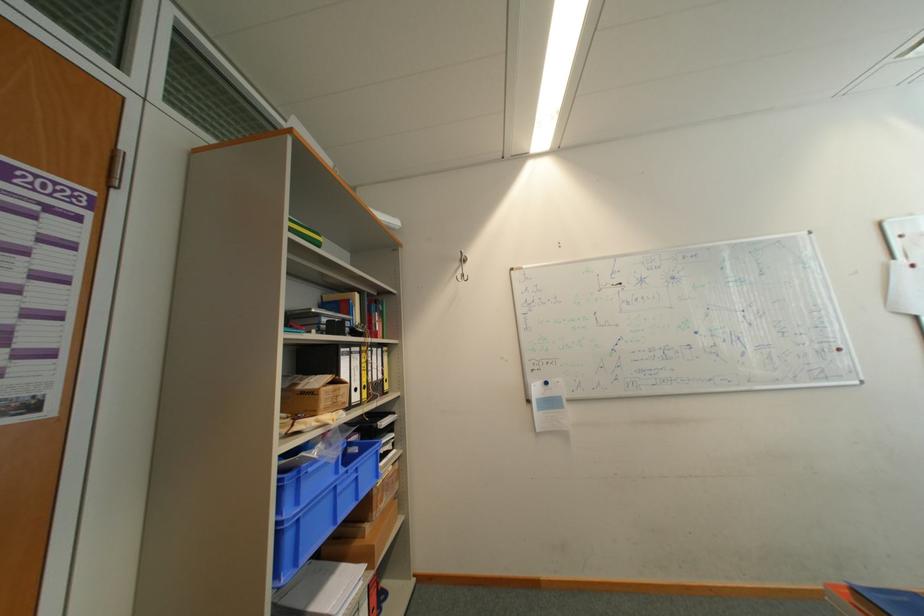
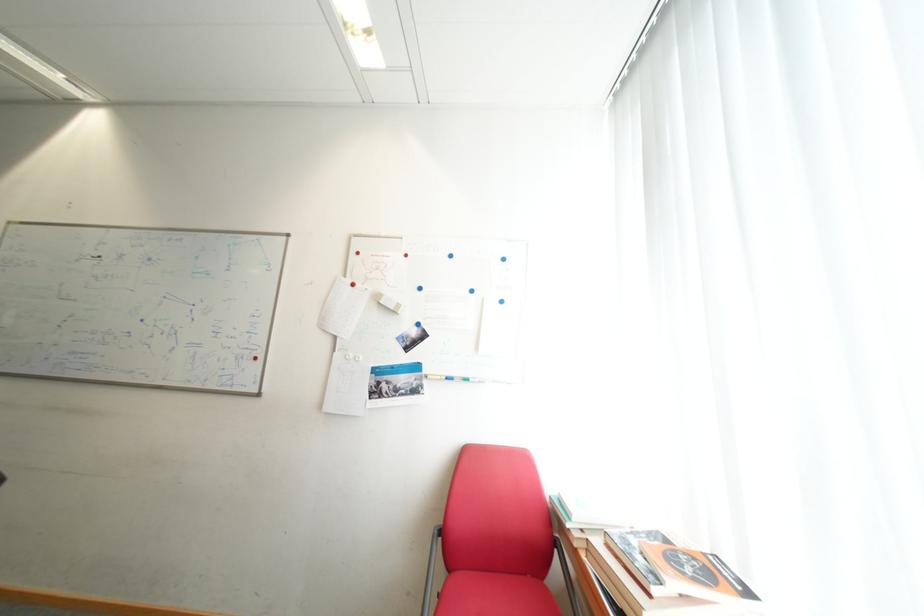
Question: What movement of the cameraman would produce the second image?

Choices:
 (A) Left
 (B) Right
 (C) Forward
 (D) Backward

Answer: (B)